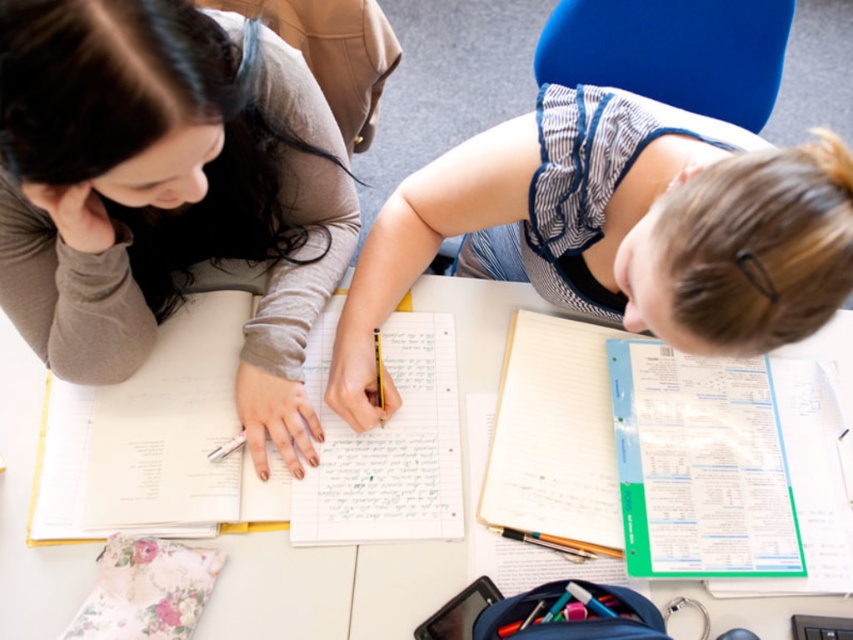
You are a student trying to place a 15cm wide textbook between the matte gray sweater at upper left and the white lined paper at center. Based on their widths, can you determine if there is enough space?

The matte gray sweater at upper left might be wider than white lined paper at center, so the total space between them may not be sufficient for a 15cm textbook. Check the actual width before placing it.

You are a student who needs to access the white paper notebook at lower right. However, it is currently blocked by the white paper notebook at center. Can you slide the notebook at center to the left to retrieve it?

The white paper notebook at center is positioned over white paper notebook at lower right, so sliding the notebook at center to the left would allow access to the white paper notebook at lower right.

You are a student sitting at the table and want to reach for the white paper notebook at center without moving your chair. Can you easily access it if the white paper notebook at lower right is blocking your direct path?

The white paper notebook at center is in front of the white paper notebook at lower right, so it is not blocked by the notebook at lower right. You can easily access the white paper notebook at center without moving your chair.